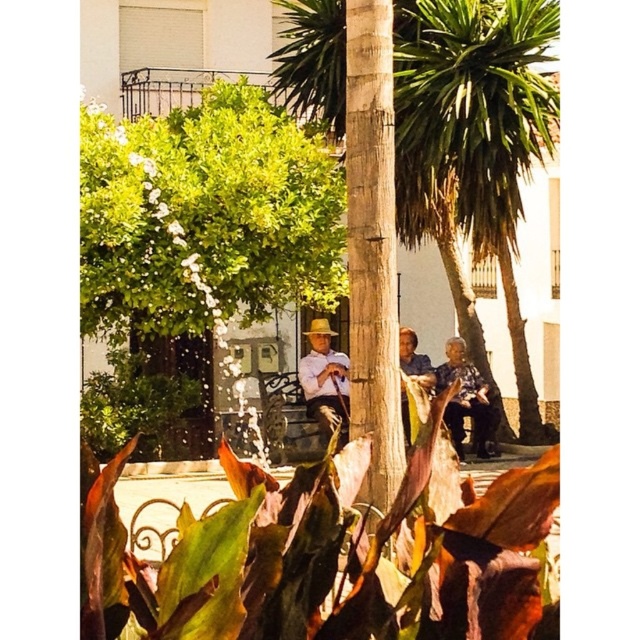
Does point (449, 10) come farther from viewer compared to point (419, 369)?

No, (449, 10) is closer to viewer.

Describe the element at coordinates (474, 145) in the screenshot. I see `green leafy palm tree at center` at that location.

At what (x,y) coordinates should I click in order to perform the action: click on green leafy palm tree at center. Please return your answer as a coordinate pair (x, y). The width and height of the screenshot is (640, 640). Looking at the image, I should click on (474, 145).

Which is below, dark blue fabric shirt at center or blue fabric shirt at center?

blue fabric shirt at center is lower down.

Can you confirm if dark blue fabric shirt at center is positioned above blue fabric shirt at center?

Yes.

Is point (470, 380) more distant than point (420, 376)?

Yes, it is behind point (420, 376).

Locate an element on the screen. The width and height of the screenshot is (640, 640). dark blue fabric shirt at center is located at coordinates (465, 401).

Image resolution: width=640 pixels, height=640 pixels. What do you see at coordinates (204, 216) in the screenshot? I see `green leafy tree at upper left` at bounding box center [204, 216].

Does point (250, 93) lie in front of point (435, 381)?

That is True.

This screenshot has height=640, width=640. What do you see at coordinates (204, 216) in the screenshot?
I see `green leafy tree at upper left` at bounding box center [204, 216].

Find the location of `green leafy tree at upper left`. green leafy tree at upper left is located at coordinates (204, 216).